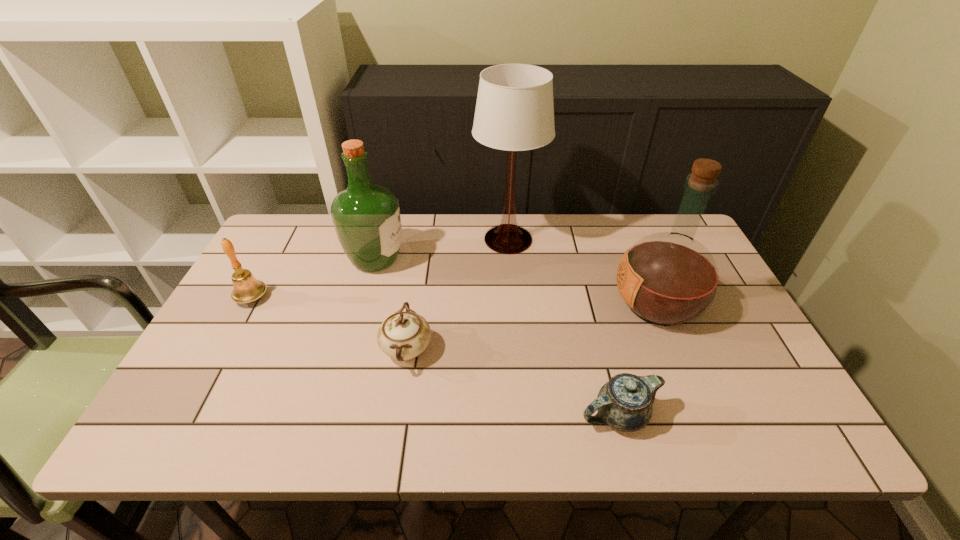
Locate an element on the screen. free region at the far left corner of the desktop is located at coordinates (262, 247).

Locate an element on the screen. This screenshot has width=960, height=540. vacant space at the near left corner of the desktop is located at coordinates (206, 446).

The height and width of the screenshot is (540, 960). Find the location of `vacant point located between the nearest object and the tallest object`. vacant point located between the nearest object and the tallest object is located at coordinates (564, 327).

You are a GUI agent. You are given a task and a screenshot of the screen. Output one action in this format:
    pyautogui.click(x=<x>, y=<y>)
    Task: Click on the empty space between the nearest object and the left chinaware
    This screenshot has height=540, width=960.
    Given the screenshot: What is the action you would take?
    pyautogui.click(x=513, y=382)

Where is `empty space between the farther chinaware and the right liquor`? The width and height of the screenshot is (960, 540). empty space between the farther chinaware and the right liquor is located at coordinates (532, 327).

At what (x,y) coordinates should I click in order to perform the action: click on free space that is in between the tallest object and the left liquor. Please return your answer as a coordinate pair (x, y). This screenshot has height=540, width=960. Looking at the image, I should click on (442, 249).

The height and width of the screenshot is (540, 960). What are the coordinates of `free spot between the third shortest object and the right liquor` in the screenshot? It's located at (454, 301).

The height and width of the screenshot is (540, 960). I want to click on vacant area that lies between the third shortest object and the farther chinaware, so click(329, 323).

Image resolution: width=960 pixels, height=540 pixels. Find the location of `vacant area between the right liquor and the right chinaware`. vacant area between the right liquor and the right chinaware is located at coordinates (637, 360).

Where is `free spot between the right liquor and the nearer chinaware`? Image resolution: width=960 pixels, height=540 pixels. free spot between the right liquor and the nearer chinaware is located at coordinates (637, 360).